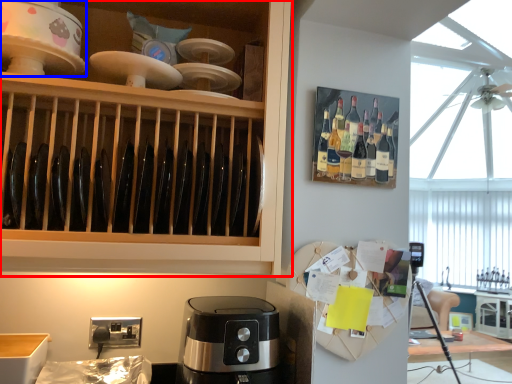
Question: Which object appears farthest to the camera in this image, cabinetry (highlighted by a red box) or home appliance (highlighted by a blue box)?

Choices:
 (A) cabinetry
 (B) home appliance

Answer: (B)